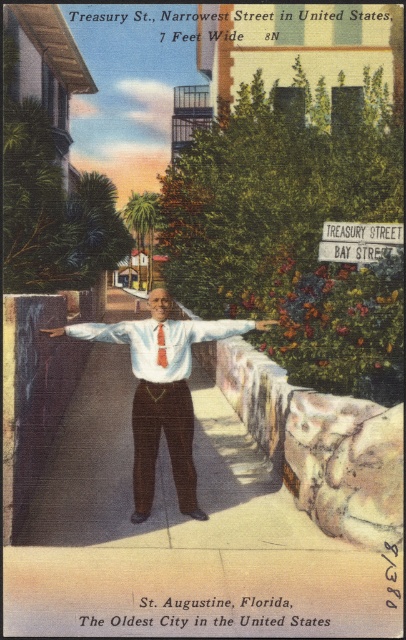
Between point (244, 326) and point (56, 332), which one is positioned in front?

Point (56, 332)

Between white cotton shirt at center and smooth leather hand at center, which one is positioned lower?

Positioned lower is smooth leather hand at center.

Is point (207, 324) less distant than point (43, 328)?

Yes, point (207, 324) is closer to viewer.

Where is `white cotton shirt at center`? Image resolution: width=406 pixels, height=640 pixels. white cotton shirt at center is located at coordinates (224, 328).

Consider the image. Measure the distance between white satin shirt at center and white matte hand at center.

The distance of white satin shirt at center from white matte hand at center is 4.07 feet.

Does white satin shirt at center have a smaller size compared to white matte hand at center?

No, white satin shirt at center is not smaller than white matte hand at center.

In order to click on white satin shirt at center in this screenshot , I will do `click(161, 406)`.

Can you confirm if white satin shirt at center is taller than white shirt at center?

Indeed, white satin shirt at center has a greater height compared to white shirt at center.

Can you confirm if white satin shirt at center is smaller than white shirt at center?

No, white satin shirt at center is not smaller than white shirt at center.

Does point (153, 374) come in front of point (88, 323)?

Yes, it is in front of point (88, 323).

Where is `white satin shirt at center`? The image size is (406, 640). white satin shirt at center is located at coordinates (161, 406).